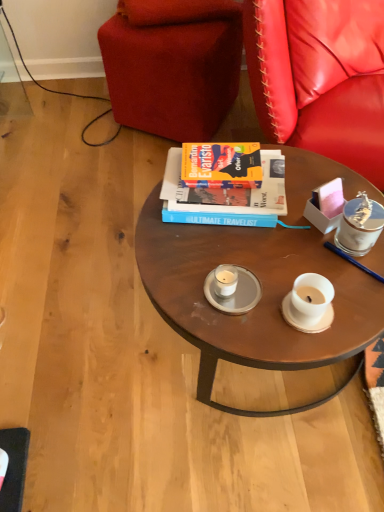
Identify the location of vacant area that is in front of silver metallic candle at upper right, the first coffee cup from the right. The image size is (384, 512). (354, 292).